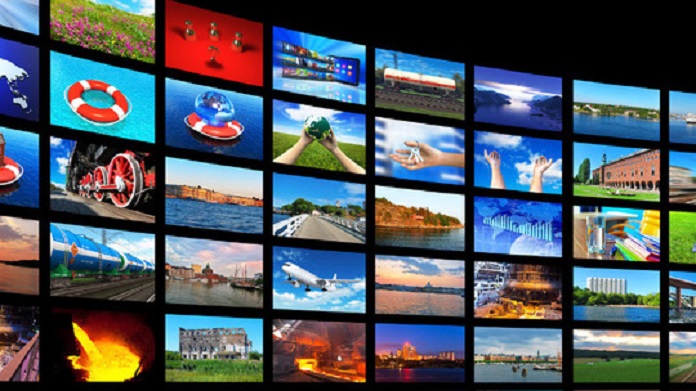
Where is `top row of pictures`? This screenshot has width=696, height=391. top row of pictures is located at coordinates (24, 24), (110, 29), (213, 48), (319, 60), (406, 78), (493, 94), (617, 108), (683, 115).